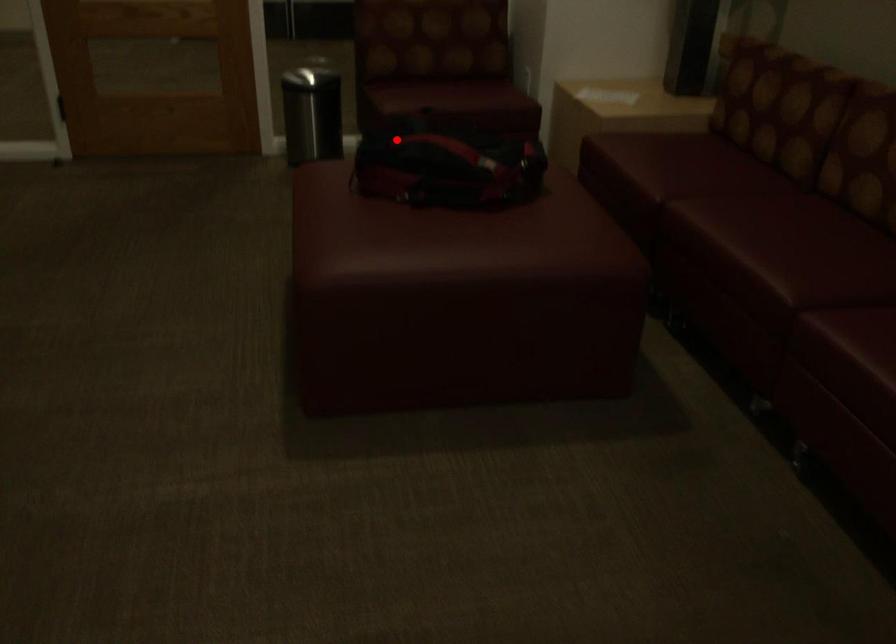
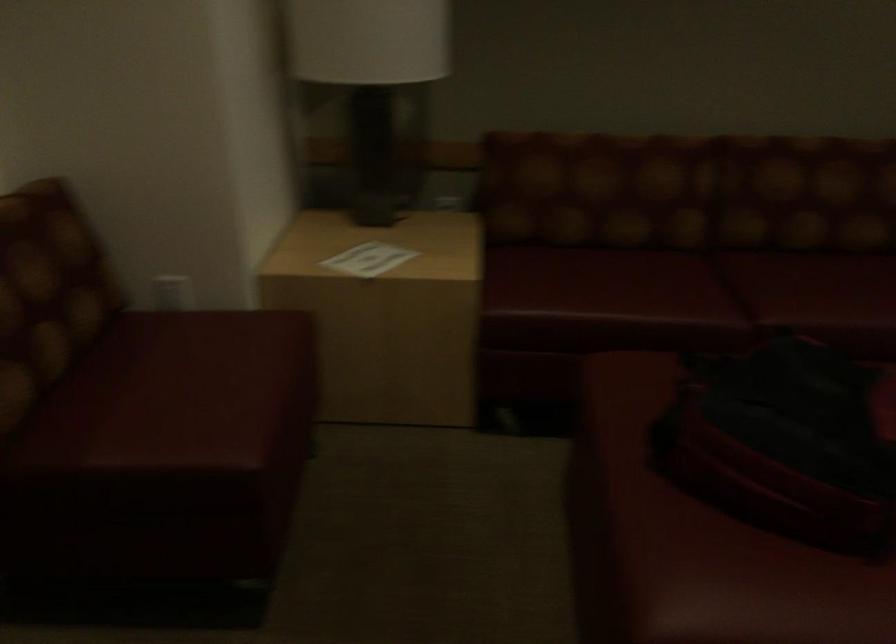
The point at the highlighted location is marked in the first image. Where is the corresponding point in the second image?

(786, 442)